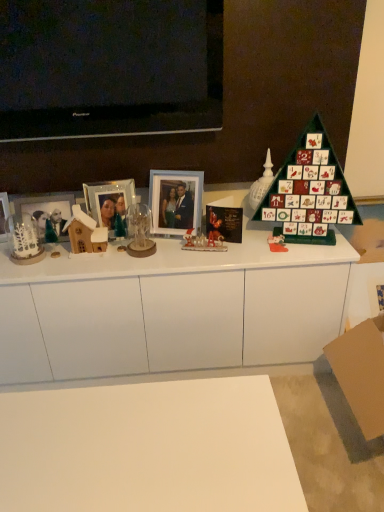
At what (x,y) coordinates should I click in order to perform the action: click on free location in front of clear glass ornament at center, arranged as the third toy when viewed from the left. Please return your answer as a coordinate pair (x, y). Image resolution: width=384 pixels, height=512 pixels. Looking at the image, I should click on (137, 263).